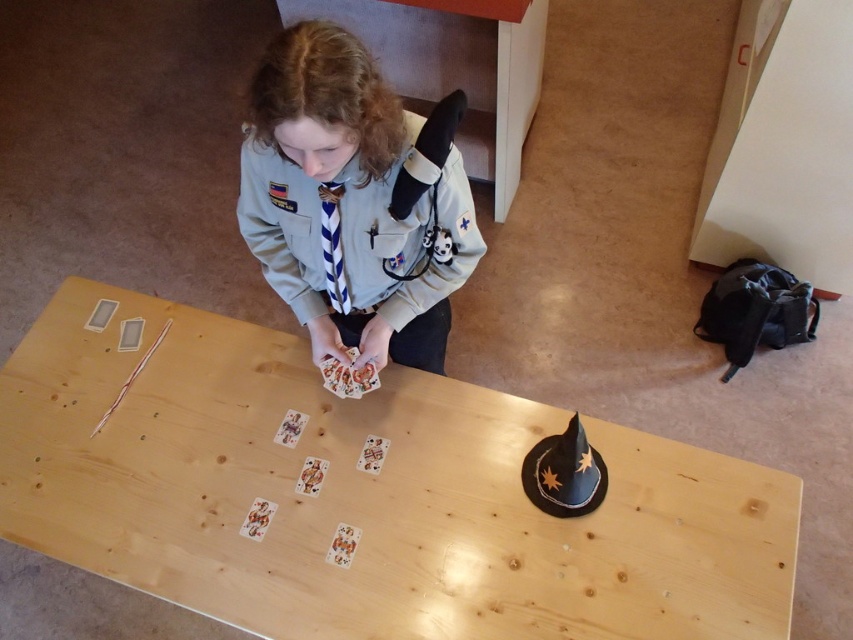
Does light wood table at center have a lesser height compared to light gray uniform at center?

In fact, light wood table at center may be taller than light gray uniform at center.

Does point (161, 589) come behind point (358, 58)?

Yes, point (161, 589) is farther from viewer.

Where is `light wood table at center`? light wood table at center is located at coordinates (364, 493).